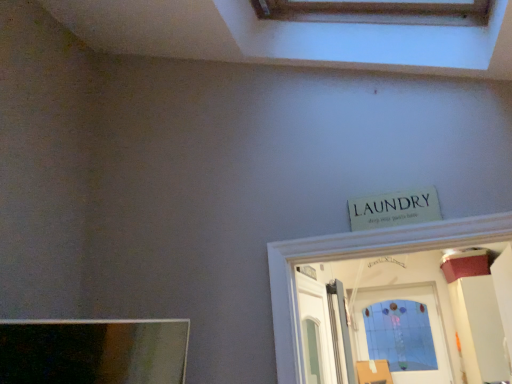
Where is `transparent glass screen door at lower right`? The width and height of the screenshot is (512, 384). transparent glass screen door at lower right is located at coordinates (390, 323).

This screenshot has height=384, width=512. What do you see at coordinates (390, 323) in the screenshot?
I see `transparent glass screen door at lower right` at bounding box center [390, 323].

Where is `transparent glass screen door at lower right`? This screenshot has height=384, width=512. transparent glass screen door at lower right is located at coordinates (390, 323).